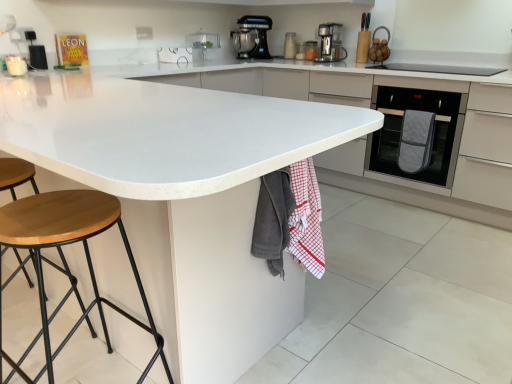
Question: Visually, is gray cotton towel at lower center, the 1th blanket viewed from the left, positioned to the left or to the right of translucent glass jar at upper center, which is the 2th appliance from back to front?

Choices:
 (A) right
 (B) left

Answer: (B)

Question: Would you say gray cotton towel at lower center, the 3th blanket in the right-to-left sequence, is inside or outside translucent glass jar at upper center, placed as the third appliance when sorted from left to right?

Choices:
 (A) outside
 (B) inside

Answer: (A)

Question: Which object is the farthest from the wooden fruit basket at upper right, acting as the 4th appliance starting from the left?

Choices:
 (A) satin black coffee machine at upper center, which ranks as the 2th kitchen appliance in left-to-right order
 (B) metallic black stand mixer at upper center, arranged as the second kitchen appliance when viewed from the right
 (C) red checkered towel at lower center, which is the 2th blanket from front to back
 (D) black plastic speaker at upper left, placed as the 1th appliance when sorted from front to back
 (E) matte white oven at right

Answer: (D)

Question: Considering the real-world distances, which object is farthest from the matte white oven at right?

Choices:
 (A) gray cotton towel at lower center, which ranks as the 3th blanket in back-to-front order
 (B) matte glass jars at upper center, the 3th appliance positioned from the right
 (C) translucent glass jar at upper center, which ranks as the 3th appliance in front-to-back order
 (D) metallic black stand mixer at upper center, the 1th kitchen appliance when ordered from left to right
 (E) quilted gray oven mitt at right

Answer: (A)